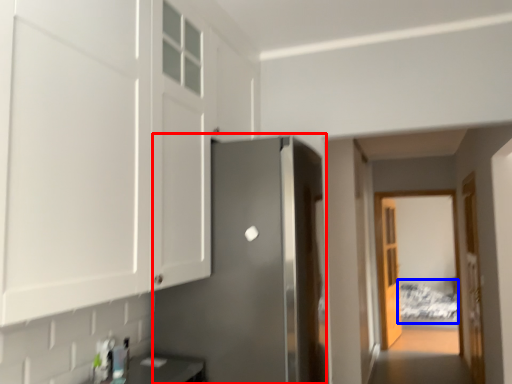
Question: Which object appears closest to the camera in this image, door (highlighted by a red box) or bed (highlighted by a blue box)?

Choices:
 (A) door
 (B) bed

Answer: (A)